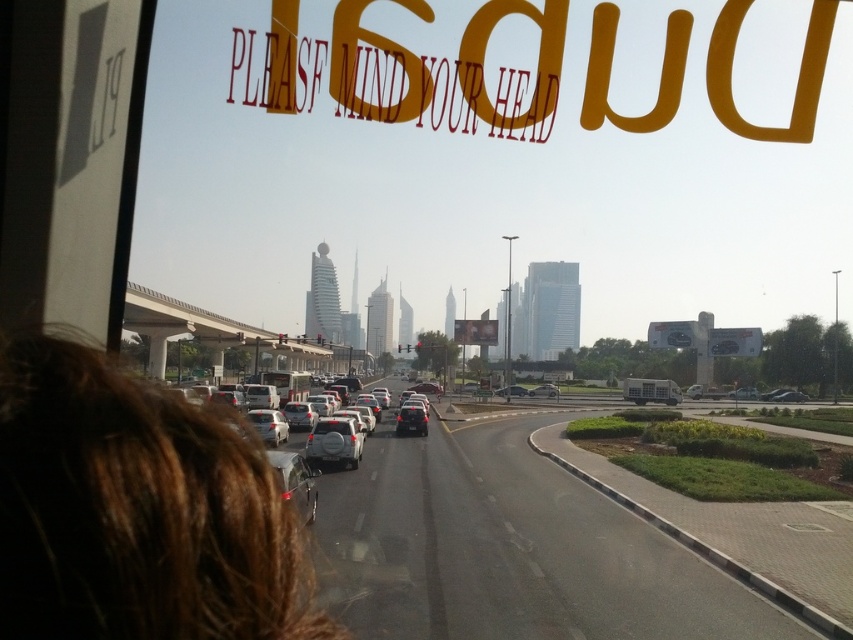
Is satin silver suv at center to the left of shiny silver sedan at center from the viewer's perspective?

Correct, you'll find satin silver suv at center to the left of shiny silver sedan at center.

Is satin silver suv at center smaller than shiny silver sedan at center?

Indeed, satin silver suv at center has a smaller size compared to shiny silver sedan at center.

Does point (326, 448) come in front of point (405, 426)?

That is True.

You are a GUI agent. You are given a task and a screenshot of the screen. Output one action in this format:
    pyautogui.click(x=<x>, y=<y>)
    Task: Click on the satin silver suv at center
    
    Given the screenshot: What is the action you would take?
    pyautogui.click(x=334, y=442)

Can you confirm if shiny silver car at center is taller than shiny silver sedan at center?

Yes, shiny silver car at center is taller than shiny silver sedan at center.

Between point (299, 497) and point (416, 401), which one is positioned behind?

The point (416, 401) is more distant.

In order to click on shiny silver car at center in this screenshot , I will do `click(294, 483)`.

Where is `shiny silver car at center`? The height and width of the screenshot is (640, 853). shiny silver car at center is located at coordinates (294, 483).

Does point (351, 516) come closer to viewer compared to point (334, 422)?

That is True.

Does point (525, 461) come behind point (349, 464)?

Yes.

What do you see at coordinates (508, 550) in the screenshot? I see `metallic gray cars at center` at bounding box center [508, 550].

The image size is (853, 640). What are the coordinates of `metallic gray cars at center` in the screenshot? It's located at (508, 550).